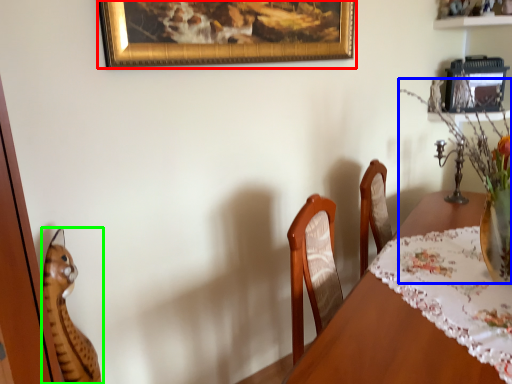
Question: Considering the real-world distances, which object is farthest from picture frame (highlighted by a red box)? floral arrangement (highlighted by a blue box) or cat (highlighted by a green box)?

Choices:
 (A) floral arrangement
 (B) cat

Answer: (B)